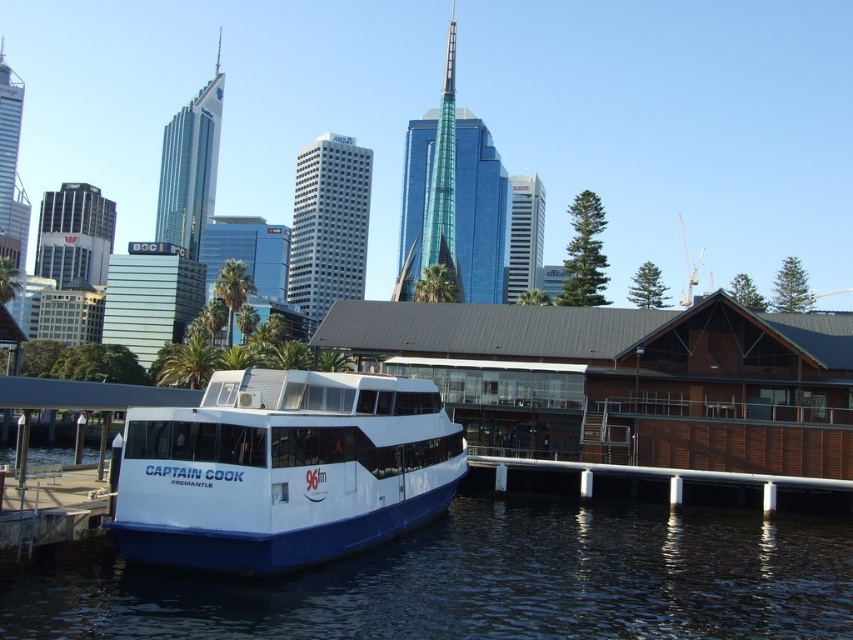
You are a photographer standing on the pier and want to capture both the transparent blue water at lower center and the white glossy boat at center in a single shot. Which object should you focus on first to ensure both are in the frame?

You should focus on the white glossy boat at center first since the transparent blue water at lower center is in front of it, allowing both to be captured in the frame when centered on the boat.

You are a photographer standing on the pier and want to capture both the transparent blue water at lower center and the white glossy boat at center in the same frame. Which object should you position closer to the left side of your camera viewfinder to ensure both are visible?

To ensure both the transparent blue water at lower center and the white glossy boat at center are visible, position the white glossy boat at center on the left side of the camera viewfinder since the transparent blue water at lower center is on its right side.

You are standing at the ferry boat named Captain Cook and looking towards the skyline. There are two points marked in the scene. The first point is at coordinates point [384,636] and the second point is at point [160,492]. Which of these two points is closer to you?

Point [384,636] is closer to the camera than point [160,492].